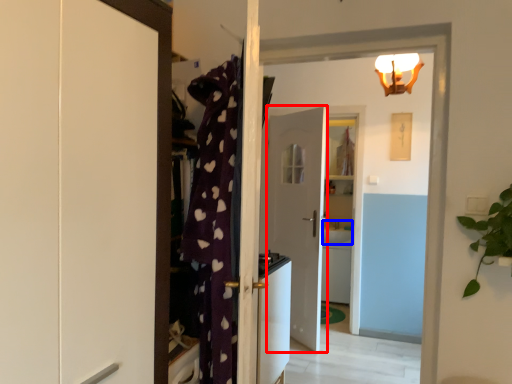
Question: Which point is closer to the camera, door (highlighted by a red box) or sink (highlighted by a blue box)?

Choices:
 (A) door
 (B) sink

Answer: (A)